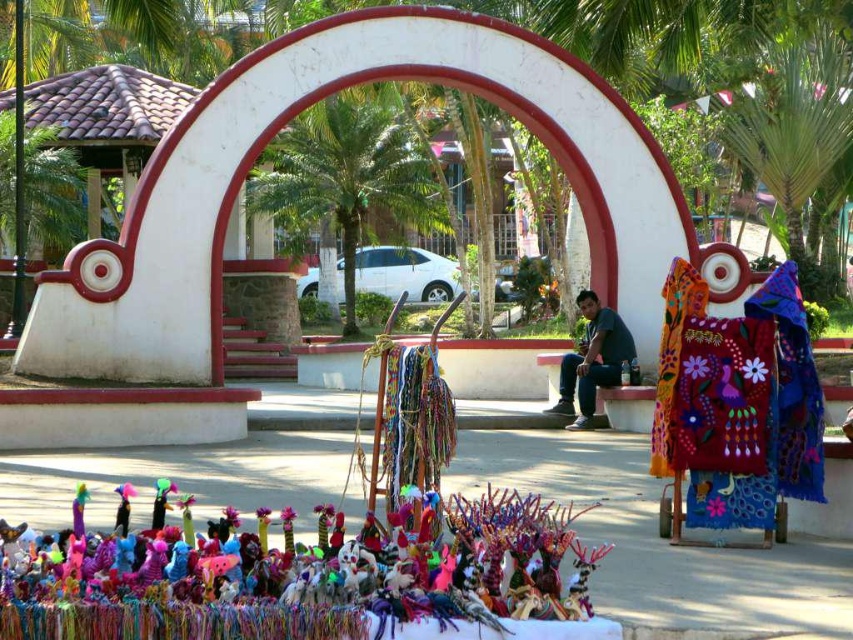
Can you confirm if brightly colored yarn at lower center is smaller than matte black shirt at center?

No, brightly colored yarn at lower center is not smaller than matte black shirt at center.

Locate an element on the screen. This screenshot has width=853, height=640. brightly colored yarn at lower center is located at coordinates 314,577.

Which is more to the left, white marble archway at center or green leafy palm tree at center?

From the viewer's perspective, green leafy palm tree at center appears more on the left side.

Which is below, white marble archway at center or green leafy palm tree at center?

green leafy palm tree at center

At what (x,y) coordinates should I click in order to perform the action: click on white marble archway at center. Please return your answer as a coordinate pair (x, y). The image size is (853, 640). Looking at the image, I should click on (289, 118).

Can you confirm if green leafy palm tree at center is positioned to the left of green leafy palm tree at upper right?

Correct, you'll find green leafy palm tree at center to the left of green leafy palm tree at upper right.

Which of these two, green leafy palm tree at center or green leafy palm tree at upper right, stands taller?

Standing taller between the two is green leafy palm tree at center.

Identify the location of green leafy palm tree at center. (349, 180).